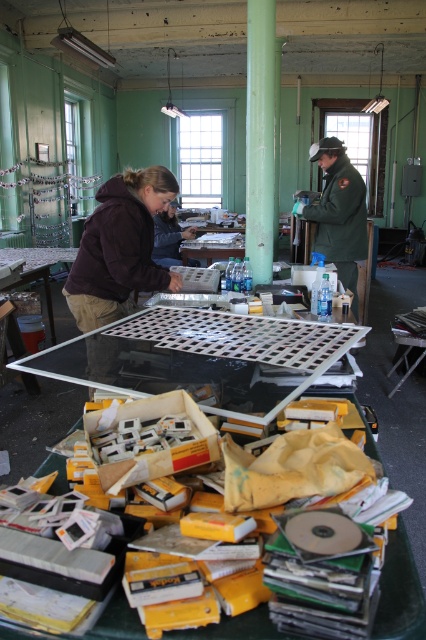
You are an employee in this workspace and need to reach both the green uniform at center and the brown fabric jacket at upper center. Which item will you need to step closer to first?

The green uniform at center is closer to the viewer than the brown fabric jacket at upper center, so you would first reach the green uniform at center before needing to step closer to the brown fabric jacket at upper center.

You are organizing the wardrobe in the workspace. You have to decide which item takes up more space between the green uniform at center and the brown fabric jacket at upper center. Which one requires more storage space?

The green uniform at center is bigger than the brown fabric jacket at upper center, so it requires more storage space.

You are a delivery person who needs to place a green uniform at center into a storage locker located at the far end of the room. The locker is 12 feet away from your current position. Can you reach the locker without moving any obstacles?

The green uniform at center is 12.20 feet away from the locker, so yes, you can reach the locker without moving any obstacles since the distance is sufficient.